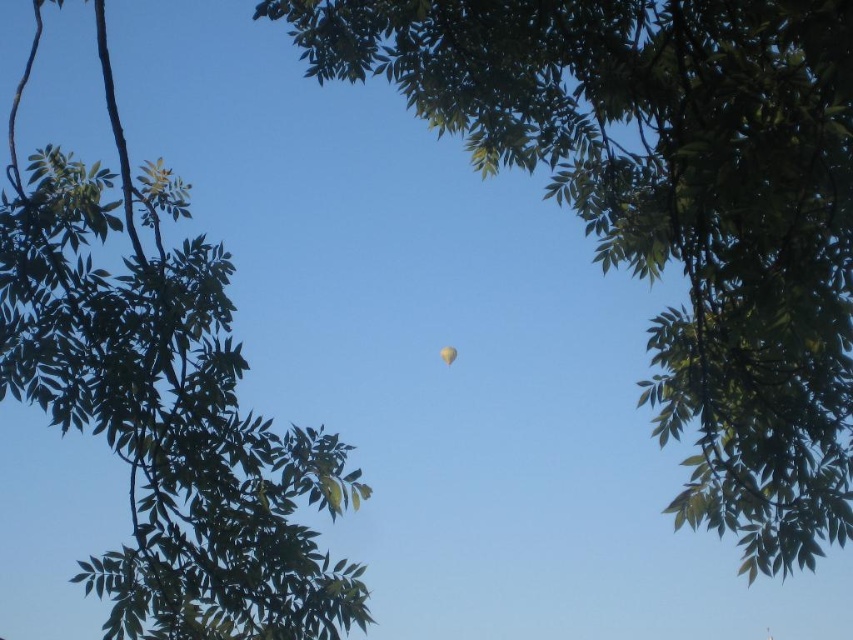
Based on the scene description provided, what object is located at the coordinates point (672,205)?

The point (672,205) indicates green leafy tree at center.

You are a bird flying towards the green leafy tree at center and the green leafy tree at upper center. Which tree will you reach first?

The green leafy tree at center is in front of the green leafy tree at upper center, so you will reach the green leafy tree at center first.

You are an artist trying to sketch this scene. You want to ensure the green leafy tree at upper center and the translucent yellow balloon at center are proportionally accurate. Which object should you draw first to maintain the correct size relationship?

The green leafy tree at upper center should be drawn first because it has a larger size compared to the translucent yellow balloon at center, ensuring the balloon is proportionally smaller in your sketch.